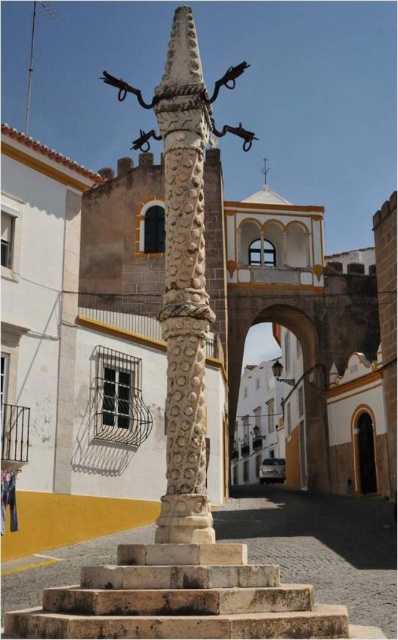
Is white carved stone totem pole at center smaller than stone stairs at center?

Answer: Actually, white carved stone totem pole at center might be larger than stone stairs at center.

Who is positioned more to the left, white carved stone totem pole at center or stone stairs at center?

white carved stone totem pole at center is more to the left.

Describe the element at coordinates (185, 275) in the screenshot. I see `white carved stone totem pole at center` at that location.

Image resolution: width=398 pixels, height=640 pixels. Identify the location of white carved stone totem pole at center. (185, 275).